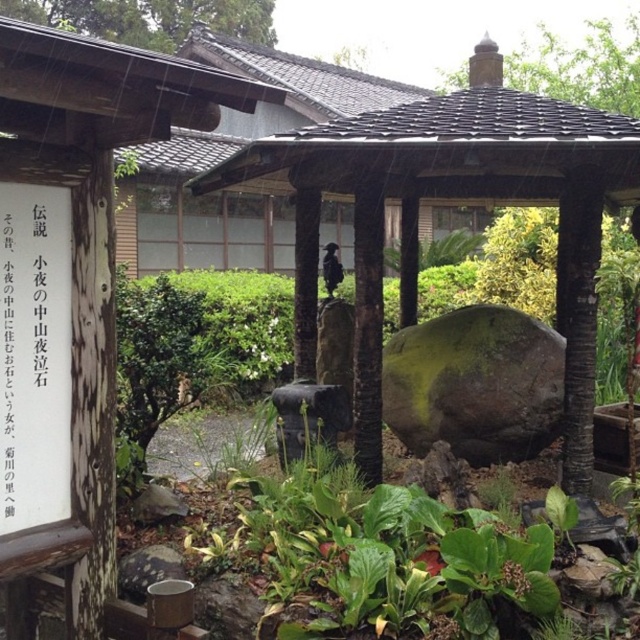
Question: Is smooth wooden gazebo at center below white paper sign at left?

Choices:
 (A) no
 (B) yes

Answer: (A)

Question: Does smooth wooden gazebo at center lie behind white paper sign at left?

Choices:
 (A) yes
 (B) no

Answer: (A)

Question: Which object appears farthest from the camera in this image?

Choices:
 (A) white paper sign at left
 (B) smooth stone hut at center
 (C) smooth wooden gazebo at center

Answer: (C)

Question: Which object appears farthest from the camera in this image?

Choices:
 (A) smooth stone hut at center
 (B) white paper sign at left
 (C) smooth wooden gazebo at center

Answer: (C)

Question: Considering the real-world distances, which object is closest to the white paper sign at left?

Choices:
 (A) smooth wooden gazebo at center
 (B) smooth stone hut at center

Answer: (B)

Question: Does smooth stone hut at center appear under white paper sign at left?

Choices:
 (A) no
 (B) yes

Answer: (B)